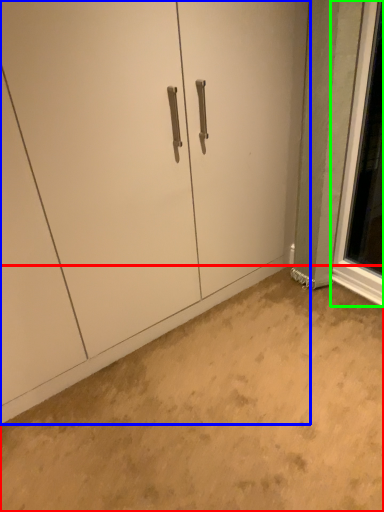
Question: Which is farther away from concrete (highlighted by a red box)? door (highlighted by a blue box) or window (highlighted by a green box)?

Choices:
 (A) door
 (B) window

Answer: (B)